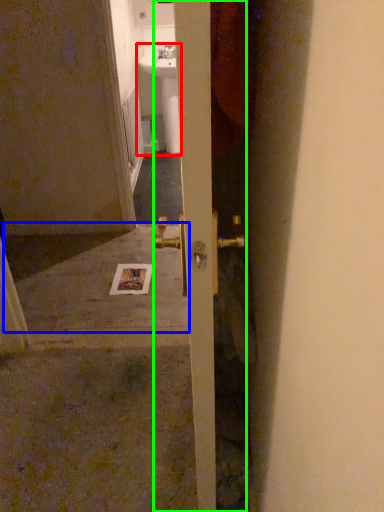
Question: Estimate the real-world distances between objects in this image. Which object is closer to sink (highlighted by a red box), concrete (highlighted by a blue box) or door (highlighted by a green box)?

Choices:
 (A) concrete
 (B) door

Answer: (A)